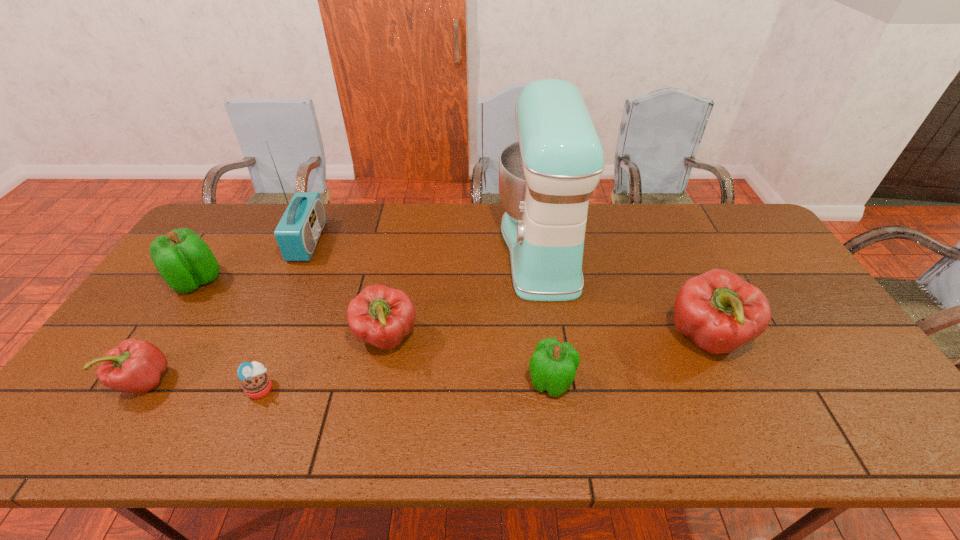
Where is `free point between the radio receiver and the leftmost pink bell pepper`? Image resolution: width=960 pixels, height=540 pixels. free point between the radio receiver and the leftmost pink bell pepper is located at coordinates 227,311.

In order to click on free point between the shortest object and the fourth object from right to left in this screenshot , I will do `click(324, 363)`.

Select which object is the seventh closest to the bigger green bell pepper. Please provide its 2D coordinates. Your answer should be formatted as a tuple, i.e. [(x, y)], where the tuple contains the x and y coordinates of a point satisfying the conditions above.

[(718, 311)]

Identify the location of object that stands as the fifth closest to the second biggest pink bell pepper. (135, 366).

Find the location of a particular element. the third closest bell pepper relative to the light mixer is located at coordinates (381, 316).

Locate which bell pepper ranks in proximity to the light mixer. Please provide its 2D coordinates. Your answer should be formatted as a tuple, i.e. [(x, y)], where the tuple contains the x and y coordinates of a point satisfying the conditions above.

[(718, 311)]

Where is `pink bell pepper that can be found as the closest to the second smallest pink bell pepper`? pink bell pepper that can be found as the closest to the second smallest pink bell pepper is located at coordinates (135, 366).

The width and height of the screenshot is (960, 540). Identify the location of pink bell pepper identified as the second closest to the third bell pepper from right to left. (718, 311).

Identify the location of free space that satisfies the following two spatial constraints: 1. on the front panel of the second bell pepper from right to left; 2. on the left side of the radio receiver. (246, 381).

You are a GUI agent. You are given a task and a screenshot of the screen. Output one action in this format:
    pyautogui.click(x=<x>, y=<y>)
    Task: Click on the vacant area in the image that satisfies the following two spatial constraints: 1. on the front panel of the radio receiver; 2. on the front side of the left green bell pepper
    The width and height of the screenshot is (960, 540).
    Given the screenshot: What is the action you would take?
    291,281